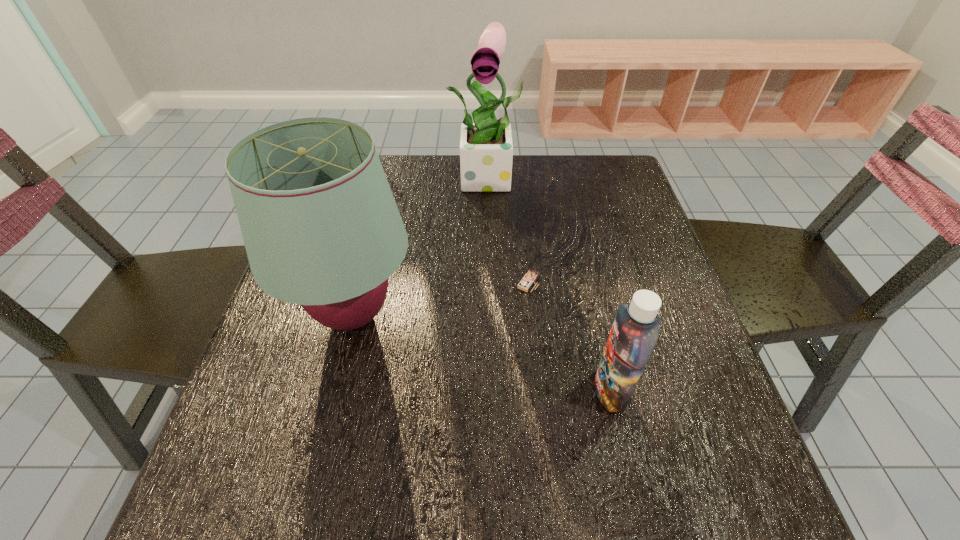
Find the location of a particular element. The width and height of the screenshot is (960, 540). vacant space that satisfies the following two spatial constraints: 1. on the front-facing side of the flower arrangement; 2. on the left side of the matchbox is located at coordinates (494, 282).

Where is `vacant space that satisfies the following two spatial constraints: 1. on the front-facing side of the shortest object; 2. on the left side of the flower arrangement`? This screenshot has height=540, width=960. vacant space that satisfies the following two spatial constraints: 1. on the front-facing side of the shortest object; 2. on the left side of the flower arrangement is located at coordinates (494, 282).

You are a GUI agent. You are given a task and a screenshot of the screen. Output one action in this format:
    pyautogui.click(x=<x>, y=<y>)
    Task: Click on the free spot that satisfies the following two spatial constraints: 1. on the front-facing side of the flower arrangement; 2. on the left side of the matchbox
    
    Given the screenshot: What is the action you would take?
    pyautogui.click(x=494, y=282)